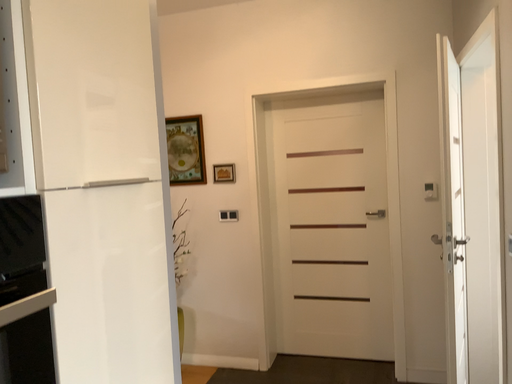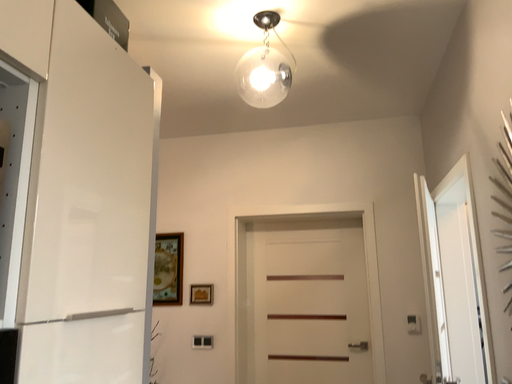
Question: Which way did the camera rotate in the video?

Choices:
 (A) rotated upward
 (B) rotated downward

Answer: (A)